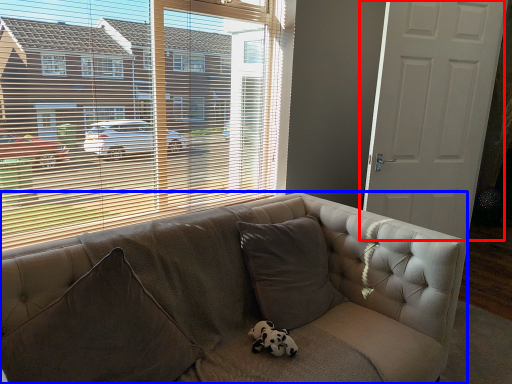
Question: Which object appears closest to the camera in this image, door (highlighted by a red box) or studio couch (highlighted by a blue box)?

Choices:
 (A) door
 (B) studio couch

Answer: (B)